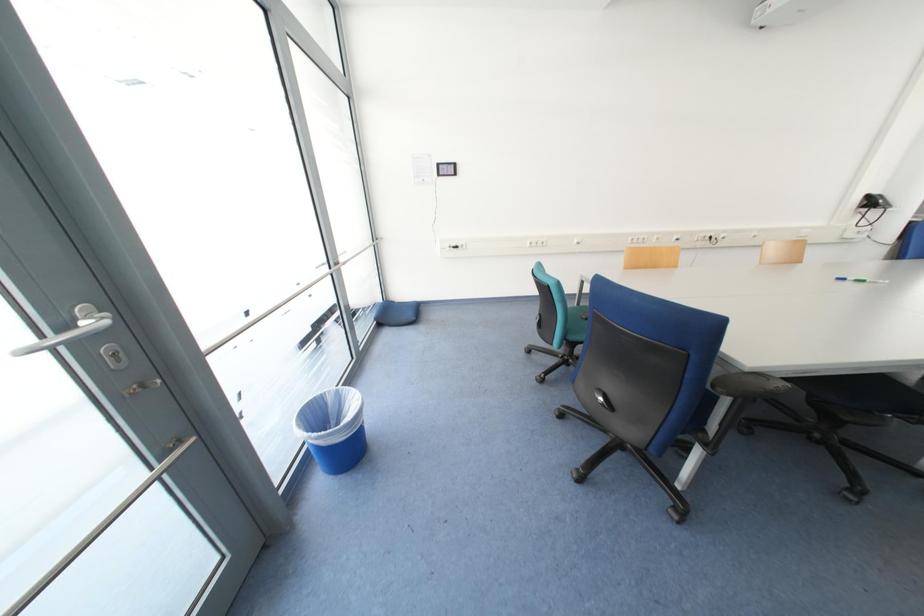
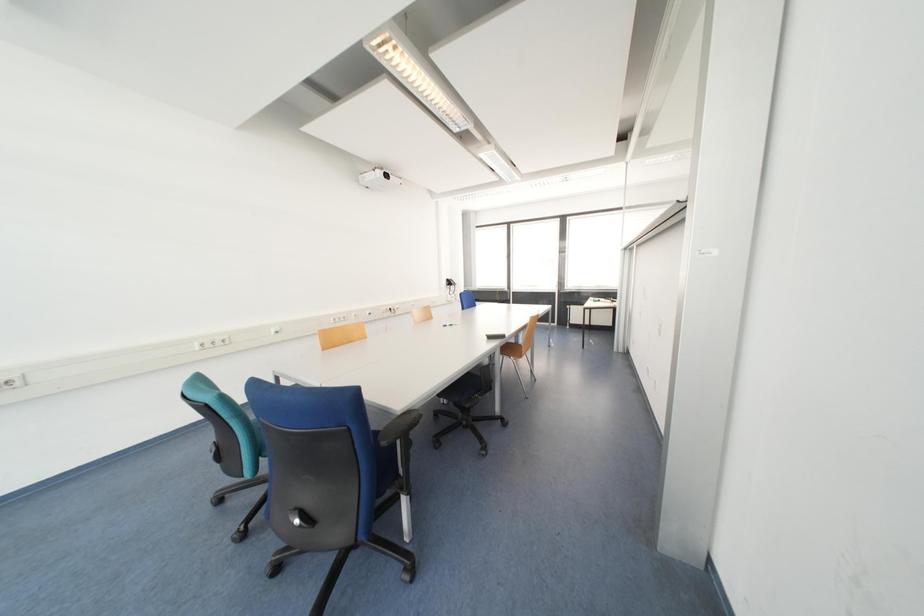
Question: The camera is either moving clockwise (left) or counter-clockwise (right) around the object. The first image is from the beginning of the video and the second image is from the end. Is the camera moving left or right when shooting the video?

Choices:
 (A) Left
 (B) Right

Answer: (A)